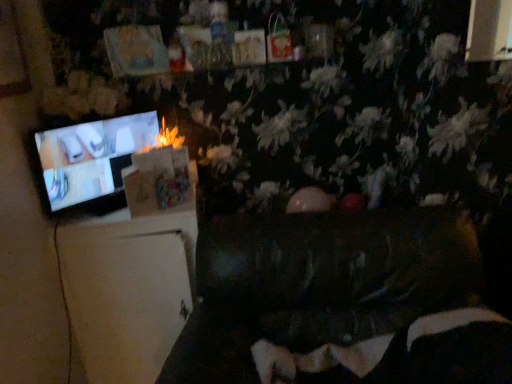
Where is `dark brown leather couch at center, the 2th furniture viewed from the left`? The width and height of the screenshot is (512, 384). dark brown leather couch at center, the 2th furniture viewed from the left is located at coordinates (341, 302).

The height and width of the screenshot is (384, 512). Describe the element at coordinates (341, 302) in the screenshot. I see `dark brown leather couch at center, the 2th furniture viewed from the left` at that location.

In order to click on white matte refrigerator at left, arranged as the second furniture when viewed from the right in this screenshot , I will do `click(129, 288)`.

This screenshot has height=384, width=512. What do you see at coordinates (404, 354) in the screenshot? I see `velvet black bean bag chair at lower center` at bounding box center [404, 354].

I want to click on matte black television at left, so click(x=91, y=157).

Is white matte refrigerator at left, placed as the 1th furniture when sorted from left to right, positioned with its back to velvet black bean bag chair at lower center?

That's not correct — white matte refrigerator at left, placed as the 1th furniture when sorted from left to right, is not looking away from velvet black bean bag chair at lower center.

Looking at this image, from the image's perspective, relative to velvet black bean bag chair at lower center, is white matte refrigerator at left, placed as the 1th furniture when sorted from left to right, above or below?

white matte refrigerator at left, placed as the 1th furniture when sorted from left to right, is above velvet black bean bag chair at lower center.

Is point (133, 262) positioned after point (447, 383)?

Yes, point (133, 262) is farther from viewer.

The image size is (512, 384). I want to click on bean bag chair in front of the white matte refrigerator at left, placed as the 1th furniture when sorted from left to right, so click(x=404, y=354).

Could you measure the distance between matte black television at left and white matte refrigerator at left, placed as the 1th furniture when sorted from left to right?

A distance of 12.89 inches exists between matte black television at left and white matte refrigerator at left, placed as the 1th furniture when sorted from left to right.

Where is `television on the left of white matte refrigerator at left, arranged as the second furniture when viewed from the right`? television on the left of white matte refrigerator at left, arranged as the second furniture when viewed from the right is located at coordinates (91, 157).

Which is more to the left, matte black television at left or white matte refrigerator at left, placed as the 1th furniture when sorted from left to right?

From the viewer's perspective, matte black television at left appears more on the left side.

From the image's perspective, which object appears higher, matte black television at left or white matte refrigerator at left, arranged as the second furniture when viewed from the right?

matte black television at left is shown above in the image.

Does white matte refrigerator at left, arranged as the second furniture when viewed from the right, come in front of matte black television at left?

No.

Identify the location of television in front of the white matte refrigerator at left, placed as the 1th furniture when sorted from left to right. The height and width of the screenshot is (384, 512). (91, 157).

Is white matte refrigerator at left, arranged as the second furniture when viewed from the right, far away from matte black television at left?

white matte refrigerator at left, arranged as the second furniture when viewed from the right, is actually quite close to matte black television at left.

Choose the correct answer: Is white matte refrigerator at left, arranged as the second furniture when viewed from the right, inside matte black television at left or outside it?

The correct answer is: outside.

Could you measure the distance between dark brown leather couch at center, marked as the 1th furniture in a right-to-left arrangement, and velvet black bean bag chair at lower center?

dark brown leather couch at center, marked as the 1th furniture in a right-to-left arrangement, and velvet black bean bag chair at lower center are 12.99 centimeters apart from each other.

Which of these two, dark brown leather couch at center, the 2th furniture viewed from the left, or velvet black bean bag chair at lower center, is smaller?

velvet black bean bag chair at lower center.

Are dark brown leather couch at center, marked as the 1th furniture in a right-to-left arrangement, and velvet black bean bag chair at lower center located far from each other?

No, there isn't a large distance between dark brown leather couch at center, marked as the 1th furniture in a right-to-left arrangement, and velvet black bean bag chair at lower center.

Between point (140, 375) and point (259, 329), which one is positioned behind?

The point (140, 375) is farther.

Identify the location of furniture on the right side of white matte refrigerator at left, arranged as the second furniture when viewed from the right. (341, 302).

Is white matte refrigerator at left, arranged as the second furniture when viewed from the right, smaller than dark brown leather couch at center, the 2th furniture viewed from the left?

Correct, white matte refrigerator at left, arranged as the second furniture when viewed from the right, occupies less space than dark brown leather couch at center, the 2th furniture viewed from the left.

What's the angular difference between white matte refrigerator at left, arranged as the second furniture when viewed from the right, and dark brown leather couch at center, marked as the 1th furniture in a right-to-left arrangement,'s facing directions?

They differ by 9.29 degrees in their facing directions.

Looking at this image, considering the sizes of dark brown leather couch at center, the 2th furniture viewed from the left, and white matte refrigerator at left, arranged as the second furniture when viewed from the right, in the image, is dark brown leather couch at center, the 2th furniture viewed from the left, wider or thinner than white matte refrigerator at left, arranged as the second furniture when viewed from the right,?

dark brown leather couch at center, the 2th furniture viewed from the left, is wider than white matte refrigerator at left, arranged as the second furniture when viewed from the right.

How many degrees apart are the facing directions of dark brown leather couch at center, the 2th furniture viewed from the left, and white matte refrigerator at left, arranged as the second furniture when viewed from the right?

9.29 degrees separate the facing orientations of dark brown leather couch at center, the 2th furniture viewed from the left, and white matte refrigerator at left, arranged as the second furniture when viewed from the right.

Which point is more distant from viewer, (x=426, y=268) or (x=162, y=270)?

The point (x=162, y=270) is behind.

Does dark brown leather couch at center, the 2th furniture viewed from the left, have a larger size compared to white matte refrigerator at left, arranged as the second furniture when viewed from the right?

Yes, dark brown leather couch at center, the 2th furniture viewed from the left, is bigger than white matte refrigerator at left, arranged as the second furniture when viewed from the right.

Considering the sizes of objects dark brown leather couch at center, marked as the 1th furniture in a right-to-left arrangement, and matte black television at left in the image provided, who is taller, dark brown leather couch at center, marked as the 1th furniture in a right-to-left arrangement, or matte black television at left?

With more height is dark brown leather couch at center, marked as the 1th furniture in a right-to-left arrangement.

Does point (335, 278) come behind point (87, 161)?

No, (335, 278) is closer to viewer.

Is the depth of dark brown leather couch at center, marked as the 1th furniture in a right-to-left arrangement, less than that of matte black television at left?

Yes, it is in front of matte black television at left.

Locate an element on the screen. The width and height of the screenshot is (512, 384). bean bag chair in front of the white matte refrigerator at left, placed as the 1th furniture when sorted from left to right is located at coordinates (404, 354).

Where is `furniture that appears behind the matte black television at left`? The height and width of the screenshot is (384, 512). furniture that appears behind the matte black television at left is located at coordinates pos(129,288).

Which object lies nearer to the anchor point white matte refrigerator at left, placed as the 1th furniture when sorted from left to right, velvet black bean bag chair at lower center or matte black television at left?

matte black television at left is closer to white matte refrigerator at left, placed as the 1th furniture when sorted from left to right.

Consider the image. Based on their spatial positions, is dark brown leather couch at center, marked as the 1th furniture in a right-to-left arrangement, or white matte refrigerator at left, placed as the 1th furniture when sorted from left to right, further from velvet black bean bag chair at lower center?

white matte refrigerator at left, placed as the 1th furniture when sorted from left to right, lies further to velvet black bean bag chair at lower center than the other object.

When comparing their distances from dark brown leather couch at center, marked as the 1th furniture in a right-to-left arrangement, does matte black television at left or white matte refrigerator at left, arranged as the second furniture when viewed from the right, seem further?

Based on the image, matte black television at left appears to be further to dark brown leather couch at center, marked as the 1th furniture in a right-to-left arrangement.

Looking at this image, from the image, which object appears to be farther from dark brown leather couch at center, the 2th furniture viewed from the left, white matte refrigerator at left, arranged as the second furniture when viewed from the right, or matte black television at left?

The object further to dark brown leather couch at center, the 2th furniture viewed from the left, is matte black television at left.

Which object lies further to the anchor point white matte refrigerator at left, placed as the 1th furniture when sorted from left to right, velvet black bean bag chair at lower center or dark brown leather couch at center, the 2th furniture viewed from the left?

Among the two, velvet black bean bag chair at lower center is located further to white matte refrigerator at left, placed as the 1th furniture when sorted from left to right.

When comparing their distances from white matte refrigerator at left, arranged as the second furniture when viewed from the right, does dark brown leather couch at center, the 2th furniture viewed from the left, or velvet black bean bag chair at lower center seem further?

Based on the image, velvet black bean bag chair at lower center appears to be further to white matte refrigerator at left, arranged as the second furniture when viewed from the right.

Based on their spatial positions, is velvet black bean bag chair at lower center or white matte refrigerator at left, arranged as the second furniture when viewed from the right, closer to matte black television at left?

white matte refrigerator at left, arranged as the second furniture when viewed from the right.

Based on the photo, estimate the real-world distances between objects in this image. Which object is closer to velvet black bean bag chair at lower center, white matte refrigerator at left, placed as the 1th furniture when sorted from left to right, or matte black television at left?

The object closer to velvet black bean bag chair at lower center is white matte refrigerator at left, placed as the 1th furniture when sorted from left to right.

I want to click on furniture located between white matte refrigerator at left, arranged as the second furniture when viewed from the right, and velvet black bean bag chair at lower center in the left-right direction, so click(341, 302).

You are a GUI agent. You are given a task and a screenshot of the screen. Output one action in this format:
    pyautogui.click(x=<x>, y=<y>)
    Task: Click on the furniture between matte black television at left and dark brown leather couch at center, the 2th furniture viewed from the left, in the horizontal direction
    
    Given the screenshot: What is the action you would take?
    [x=129, y=288]